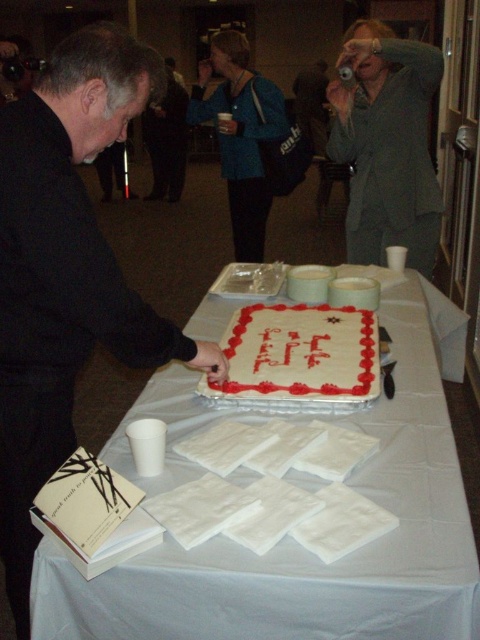
You are standing at the edge of the table and want to place a decoration on the point closer to you. Which point should you aim for, point (376, 464) or point (415, 221)?

You should aim for point (376, 464) because it is closer to the viewer than point (415, 221).

You are a photographer standing at the back of the room. You want to take a photo of the gray wool sweater at upper right and the white frosted cake at center so that both are clearly visible in the frame. Given that your camera has a maximum focus range of 1.2 meters, will you be able to capture both objects in focus without moving closer?

The gray wool sweater at upper right and white frosted cake at center are 1.15 meters apart from each other. Since the distance between them is within the camera maximum focus range of 1.2 meters, you can capture both objects in focus without moving closer.

In the scene shown: You are a guest at the cake cutting ceremony and want to grab a napkin. Which object is closer to you, the white paper napkins at center or the gray wool sweater at upper right?

The white paper napkins at center are closer to you than the gray wool sweater at upper right.